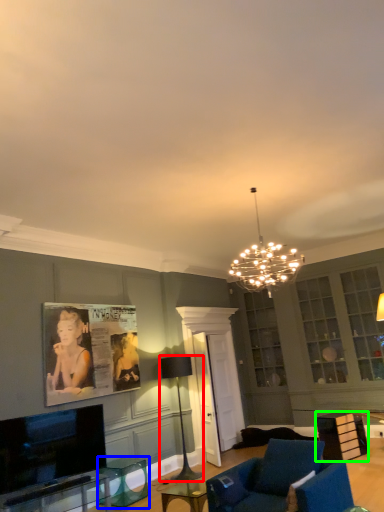
Question: Which object is the closest to the lamp (highlighted by a red box)? Choose among these: round table (highlighted by a blue box) or table (highlighted by a green box).

Choices:
 (A) round table
 (B) table

Answer: (A)